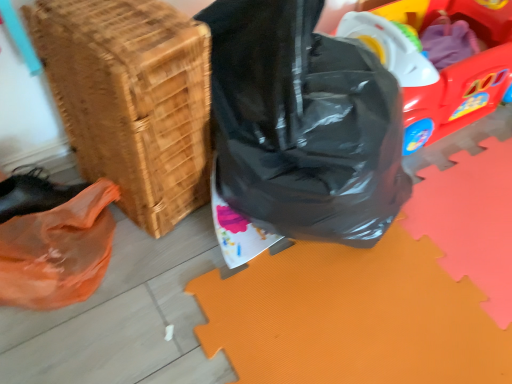
Question: Considering the relative positions of rubberized plastic wagon at upper right and woven wood basket at lower left in the image provided, is rubberized plastic wagon at upper right to the left of woven wood basket at lower left from the viewer's perspective?

Choices:
 (A) no
 (B) yes

Answer: (A)

Question: From a real-world perspective, does rubberized plastic wagon at upper right sit lower than woven wood basket at lower left?

Choices:
 (A) no
 (B) yes

Answer: (B)

Question: Can you confirm if rubberized plastic wagon at upper right is taller than woven wood basket at lower left?

Choices:
 (A) yes
 (B) no

Answer: (B)

Question: Can you confirm if rubberized plastic wagon at upper right is thinner than woven wood basket at lower left?

Choices:
 (A) no
 (B) yes

Answer: (A)

Question: Does rubberized plastic wagon at upper right turn towards woven wood basket at lower left?

Choices:
 (A) no
 (B) yes

Answer: (A)

Question: Is the depth of rubberized plastic wagon at upper right greater than that of woven wood basket at lower left?

Choices:
 (A) yes
 (B) no

Answer: (A)

Question: Is black plastic bag at center smaller than rubberized plastic wagon at upper right?

Choices:
 (A) yes
 (B) no

Answer: (B)

Question: Is black plastic bag at center bigger than rubberized plastic wagon at upper right?

Choices:
 (A) no
 (B) yes

Answer: (B)

Question: From the image's perspective, is black plastic bag at center under rubberized plastic wagon at upper right?

Choices:
 (A) yes
 (B) no

Answer: (A)

Question: Is black plastic bag at center at the right side of rubberized plastic wagon at upper right?

Choices:
 (A) yes
 (B) no

Answer: (B)

Question: Is black plastic bag at center positioned beyond the bounds of rubberized plastic wagon at upper right?

Choices:
 (A) no
 (B) yes

Answer: (B)

Question: Is the position of black plastic bag at center less distant than that of rubberized plastic wagon at upper right?

Choices:
 (A) yes
 (B) no

Answer: (A)

Question: Is black plastic bag at center aimed at woven wood basket at lower left?

Choices:
 (A) no
 (B) yes

Answer: (A)